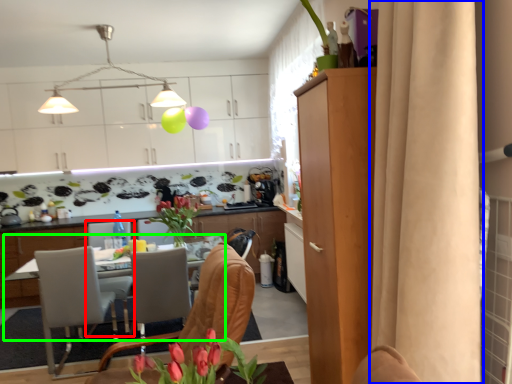
Question: Which object is the farthest from armchair (highlighted by a red box)? Choose among these: curtain (highlighted by a blue box) or desk (highlighted by a green box).

Choices:
 (A) curtain
 (B) desk

Answer: (A)